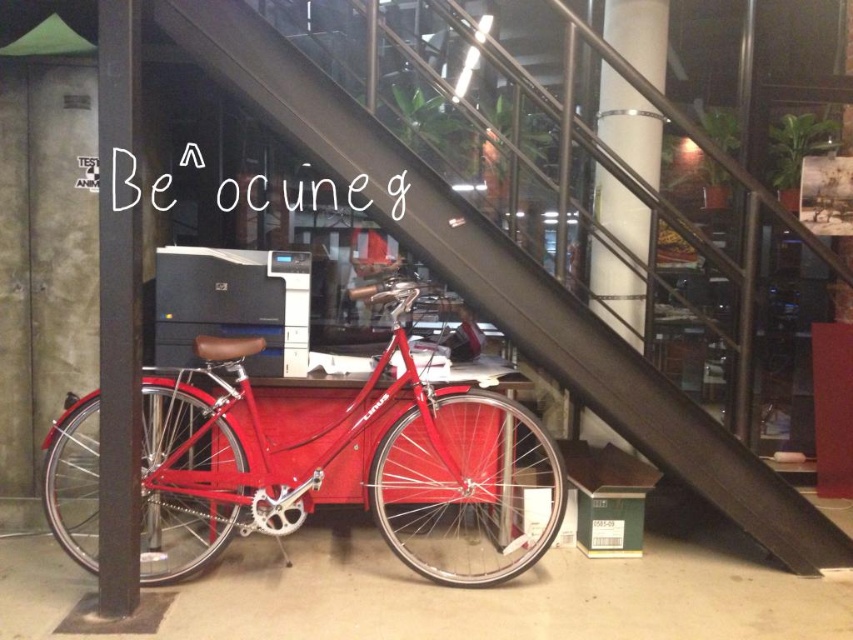
You are an office cleaner with a 24 inch wide mop. You need to clean the floor between the glossy red bicycle at center and the metallic gray pole at left. Can your mop fit through the space between them?

The glossy red bicycle at center is 23.73 inches away from the metallic gray pole at left. Since the distance between them is less than the mop width of 24 inches, the mop cannot fit through the space between the glossy red bicycle at center and the metallic gray pole at left.

You are moving a 36 inch wide box through the office and need to navigate between the metallic staircase at center and the metallic gray pole at left. Based on the space provided, will the box fit through the gap between them?

The gap between the metallic staircase at center and the metallic gray pole at left is 35.79 inches. Since the box is 36 inches wide, it will not fit through the gap as the box is slightly wider than the available space.